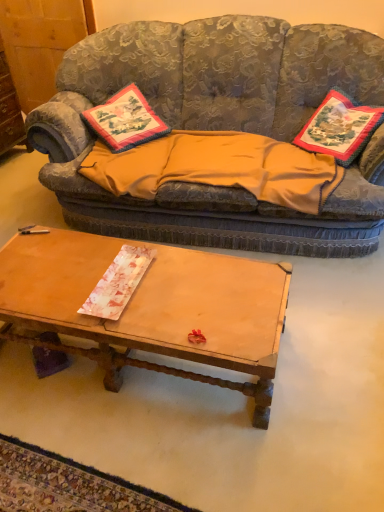
Question: From the image's perspective, is embroidered fabric pillow at right, marked as the first pillow in a right-to-left arrangement, located above or below wooden dresser at left?

Choices:
 (A) below
 (B) above

Answer: (A)

Question: Is embroidered fabric pillow at right, which is the 2th pillow in left-to-right order, inside the boundaries of wooden dresser at left, or outside?

Choices:
 (A) inside
 (B) outside

Answer: (B)

Question: Which object is positioned farthest from the embroidered fabric pillow at right, marked as the first pillow in a right-to-left arrangement?

Choices:
 (A) wooden dresser at left
 (B) textured fabric couch at upper center
 (C) embroidered fabric pillow at center, the first pillow in the left-to-right sequence
 (D) orange fabric blanket at center
 (E) wooden coffee table at center

Answer: (A)

Question: Estimate the real-world distances between objects in this image. Which object is farther from the orange fabric blanket at center?

Choices:
 (A) wooden coffee table at center
 (B) textured fabric couch at upper center
 (C) wooden dresser at left
 (D) embroidered fabric pillow at right, which is the 2th pillow in left-to-right order
 (E) embroidered fabric pillow at center, the first pillow in the left-to-right sequence

Answer: (C)